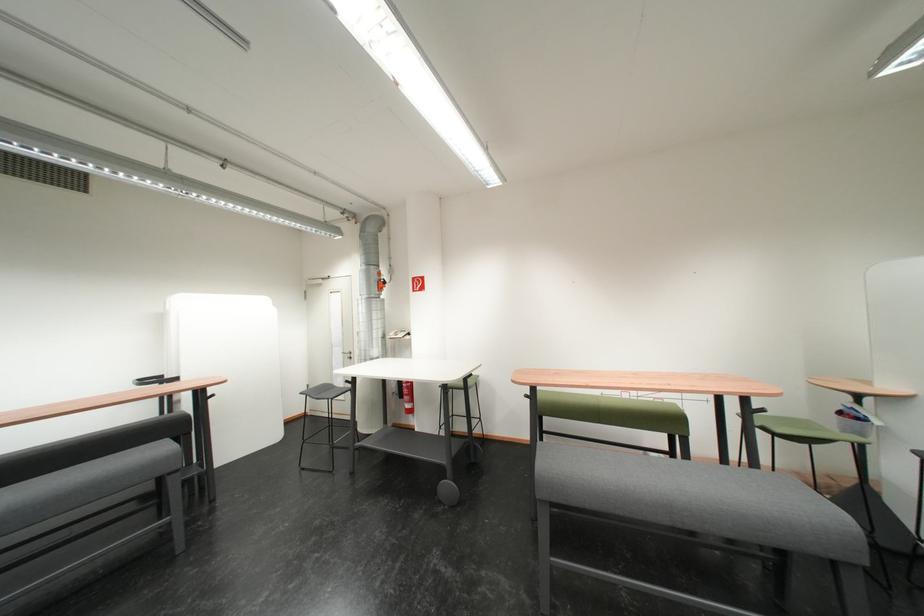
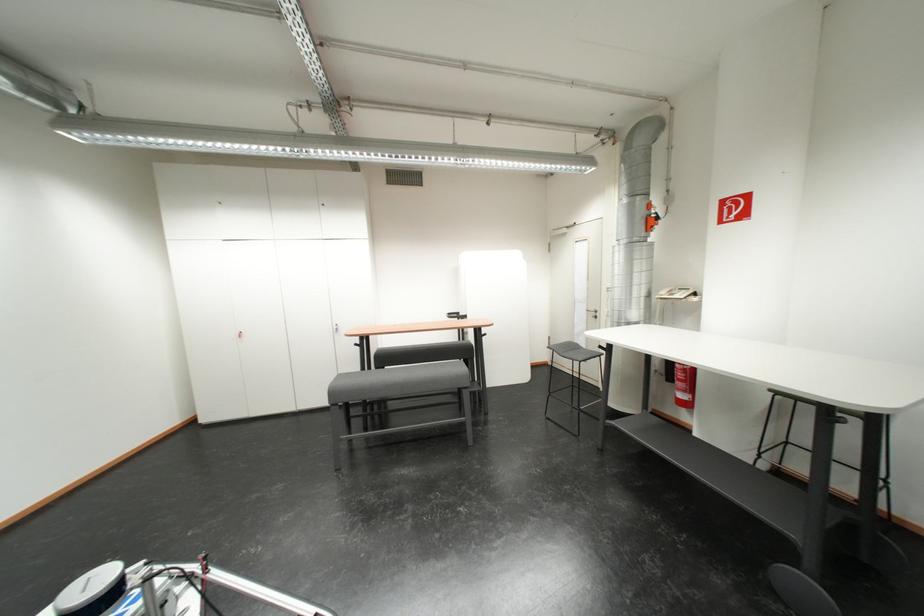
Where in the second image is the point corresponding to the point at 353,354 from the first image?

(597, 310)